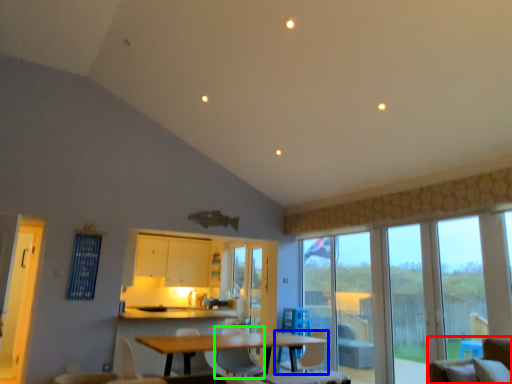
Question: Considering the real-world distances, which object is farthest from chair (highlighted by a red box)? chair (highlighted by a blue box) or chair (highlighted by a green box)?

Choices:
 (A) chair
 (B) chair

Answer: (B)